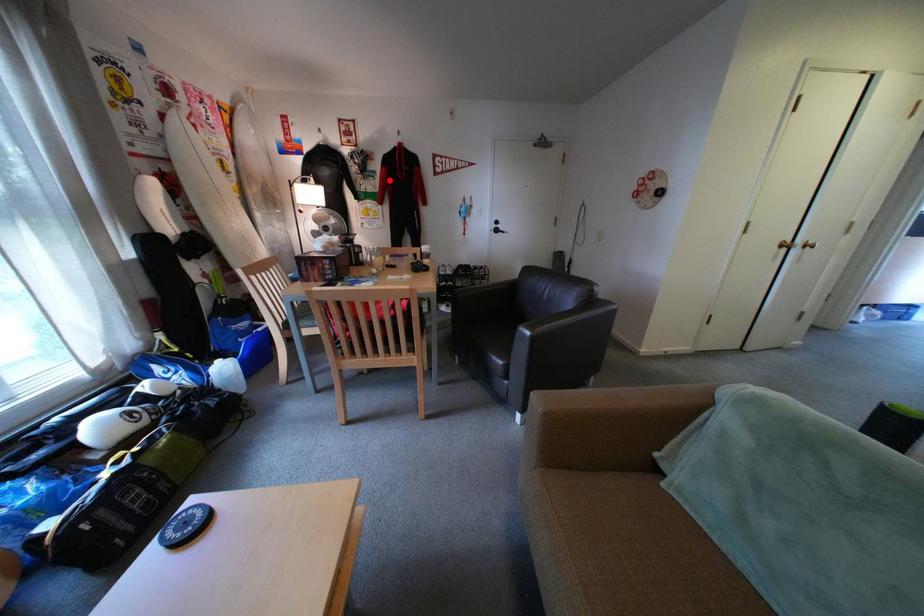
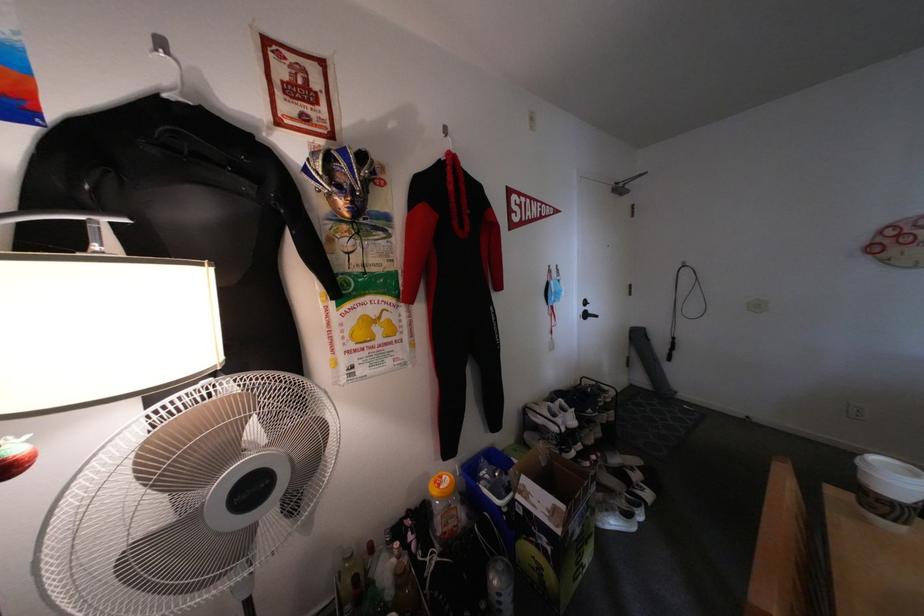
Question: I am providing you with two images of the same scene from different viewpoints. In image1, a red point is highlighted. Considering the same 3D point in image2, which of the following is correct?

Choices:
 (A) It is closer
 (B) It is farther

Answer: (B)